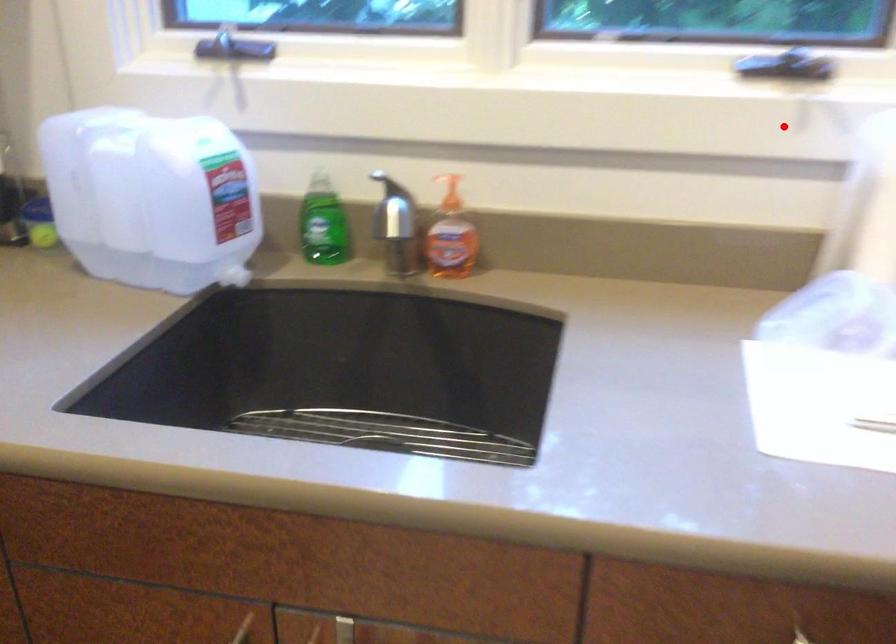
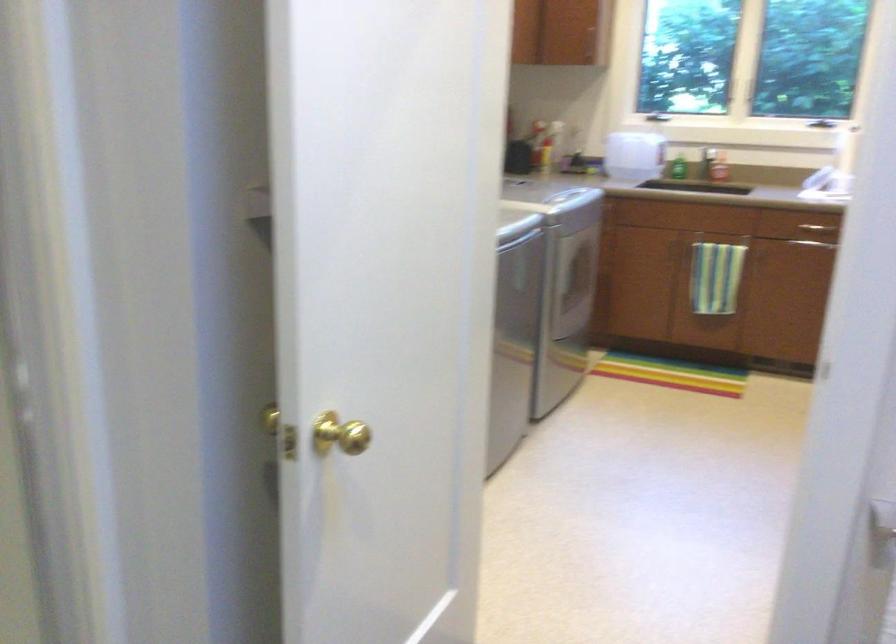
Where in the second image is the point corresponding to the highlighted location from the first image?

(817, 122)